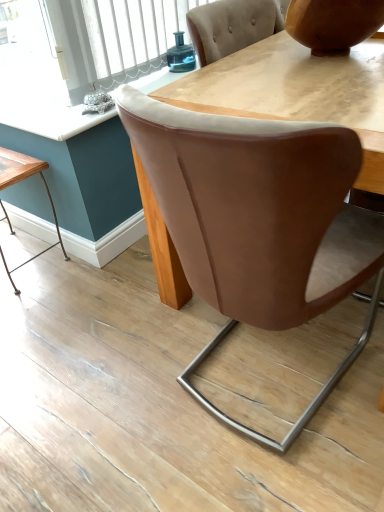
Question: Could you tell me if brown leather chair at center is facing teal glass jar at upper center?

Choices:
 (A) yes
 (B) no

Answer: (B)

Question: From a real-world perspective, is brown leather chair at center physically above teal glass jar at upper center?

Choices:
 (A) yes
 (B) no

Answer: (B)

Question: Does brown leather chair at center have a larger size compared to teal glass jar at upper center?

Choices:
 (A) no
 (B) yes

Answer: (B)

Question: Is brown leather chair at center in front of teal glass jar at upper center?

Choices:
 (A) yes
 (B) no

Answer: (A)

Question: Is brown leather chair at center wider than teal glass jar at upper center?

Choices:
 (A) no
 (B) yes

Answer: (B)

Question: Considering the relative sizes of brown leather chair at center and teal glass jar at upper center in the image provided, is brown leather chair at center shorter than teal glass jar at upper center?

Choices:
 (A) yes
 (B) no

Answer: (B)

Question: Can you confirm if teal glass jar at upper center is wider than wooden table at lower left?

Choices:
 (A) no
 (B) yes

Answer: (A)

Question: From the image's perspective, is teal glass jar at upper center beneath wooden table at lower left?

Choices:
 (A) yes
 (B) no

Answer: (B)

Question: Is teal glass jar at upper center bigger than wooden table at lower left?

Choices:
 (A) no
 (B) yes

Answer: (A)

Question: Is teal glass jar at upper center positioned beyond the bounds of wooden table at lower left?

Choices:
 (A) no
 (B) yes

Answer: (B)

Question: Is teal glass jar at upper center to the left of wooden table at lower left from the viewer's perspective?

Choices:
 (A) yes
 (B) no

Answer: (B)

Question: Could wooden table at lower left be considered to be inside teal glass jar at upper center?

Choices:
 (A) no
 (B) yes

Answer: (A)

Question: Could you tell me if wooden table at lower left is turned towards matte brown vase at upper right?

Choices:
 (A) no
 (B) yes

Answer: (A)